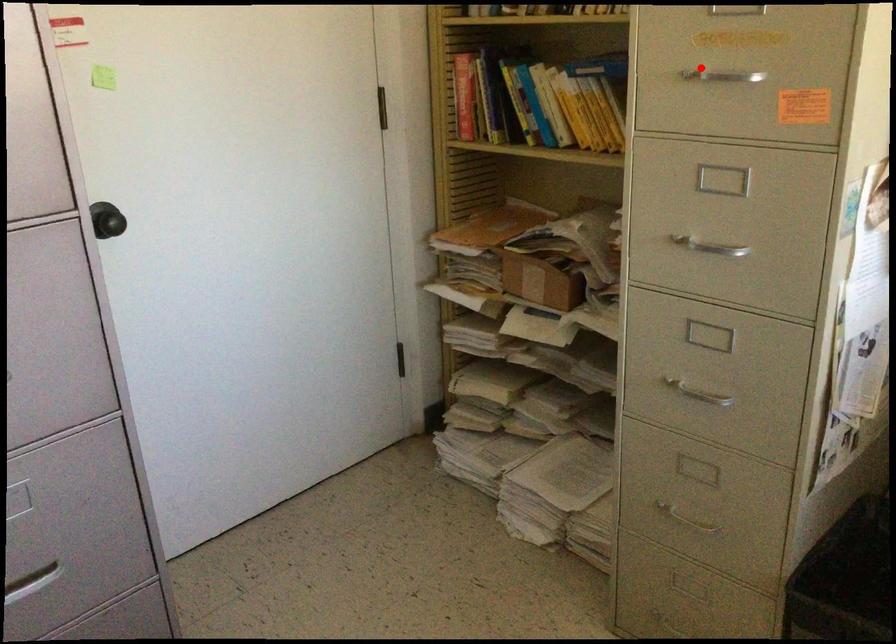
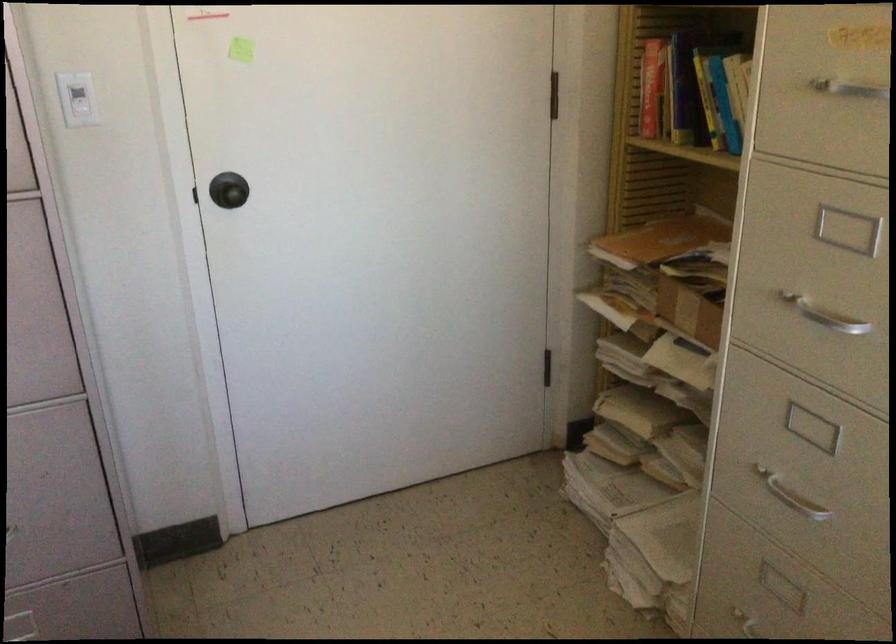
Where in the second image is the point corresponding to the highlighted location from the first image?

(839, 82)